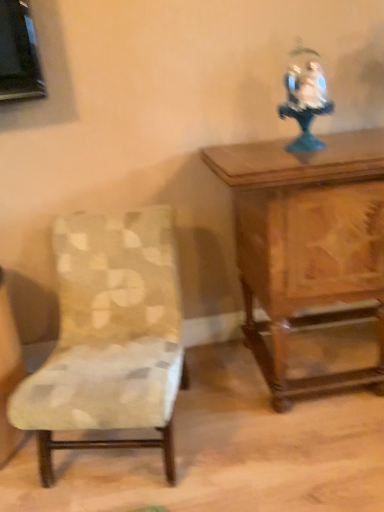
This screenshot has width=384, height=512. I want to click on vacant space underneath wooden carved table at upper right (from a real-world perspective), so click(x=318, y=362).